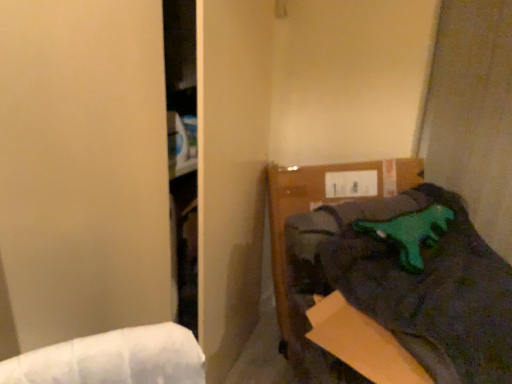
Where is `green rubber dinosaur at upper right`? The height and width of the screenshot is (384, 512). green rubber dinosaur at upper right is located at coordinates (410, 232).

The image size is (512, 384). What do you see at coordinates (410, 232) in the screenshot? I see `green rubber dinosaur at upper right` at bounding box center [410, 232].

The image size is (512, 384). In order to click on green plastic dinosaur at upper right in this screenshot , I will do tap(389, 277).

Describe the element at coordinates (389, 277) in the screenshot. I see `green plastic dinosaur at upper right` at that location.

This screenshot has width=512, height=384. I want to click on green rubber dinosaur at upper right, so click(410, 232).

Is green rubber dinosaur at upper right at the right side of green plastic dinosaur at upper right?

No.

Considering their positions, is green rubber dinosaur at upper right located in front of or behind green plastic dinosaur at upper right?

Visually, green rubber dinosaur at upper right is located behind green plastic dinosaur at upper right.

Which point is more distant from viewer, (419, 252) or (312, 191)?

The point (312, 191) is behind.

From the image's perspective, relative to green plastic dinosaur at upper right, is green rubber dinosaur at upper right above or below?

Based on their image positions, green rubber dinosaur at upper right is located above green plastic dinosaur at upper right.

From a real-world perspective, is green rubber dinosaur at upper right over green plastic dinosaur at upper right?

Yes.

Between green rubber dinosaur at upper right and green plastic dinosaur at upper right, which one has larger width?

Wider between the two is green plastic dinosaur at upper right.

Considering the sizes of objects green rubber dinosaur at upper right and green plastic dinosaur at upper right in the image provided, who is taller, green rubber dinosaur at upper right or green plastic dinosaur at upper right?

green plastic dinosaur at upper right is taller.

Who is smaller, green rubber dinosaur at upper right or green plastic dinosaur at upper right?

Answer: Smaller between the two is green rubber dinosaur at upper right.

Is green rubber dinosaur at upper right situated inside green plastic dinosaur at upper right or outside?

The correct answer is: inside.

Is green rubber dinosaur at upper right placed right next to green plastic dinosaur at upper right?

green rubber dinosaur at upper right and green plastic dinosaur at upper right are not in contact.

Is green rubber dinosaur at upper right aimed at green plastic dinosaur at upper right?

Yes.

How different are the orientations of green rubber dinosaur at upper right and green plastic dinosaur at upper right in degrees?

The angular difference between green rubber dinosaur at upper right and green plastic dinosaur at upper right is 3.64 degrees.

This screenshot has height=384, width=512. In order to click on animal above the green plastic dinosaur at upper right (from the image's perspective) in this screenshot , I will do `click(410, 232)`.

Which object is positioned more to the right, green plastic dinosaur at upper right or green rubber dinosaur at upper right?

Positioned to the right is green plastic dinosaur at upper right.

Is green plastic dinosaur at upper right in front of or behind green rubber dinosaur at upper right in the image?

In the image, green plastic dinosaur at upper right appears in front of green rubber dinosaur at upper right.

Considering the positions of point (451, 306) and point (398, 221), is point (451, 306) closer or farther from the camera than point (398, 221)?

Point (451, 306) appears to be closer to the viewer than point (398, 221).

From the image's perspective, is green plastic dinosaur at upper right located above or below green rubber dinosaur at upper right?

green plastic dinosaur at upper right is below green rubber dinosaur at upper right.

From a real-world perspective, between green plastic dinosaur at upper right and green rubber dinosaur at upper right, who is vertically higher?

green rubber dinosaur at upper right.

Is green plastic dinosaur at upper right thinner than green rubber dinosaur at upper right?

No.

Considering the relative sizes of green plastic dinosaur at upper right and green rubber dinosaur at upper right in the image provided, is green plastic dinosaur at upper right taller than green rubber dinosaur at upper right?

Yes, green plastic dinosaur at upper right is taller than green rubber dinosaur at upper right.

Considering the sizes of objects green plastic dinosaur at upper right and green rubber dinosaur at upper right in the image provided, who is smaller, green plastic dinosaur at upper right or green rubber dinosaur at upper right?

green rubber dinosaur at upper right is smaller.

Would you say green plastic dinosaur at upper right is outside green rubber dinosaur at upper right?

Yes, green plastic dinosaur at upper right is outside of green rubber dinosaur at upper right.

Would you say green plastic dinosaur at upper right is a long distance from green rubber dinosaur at upper right?

No, green plastic dinosaur at upper right is not far from green rubber dinosaur at upper right.

Consider the image. Could you tell me if green plastic dinosaur at upper right is turned towards green rubber dinosaur at upper right?

No, green plastic dinosaur at upper right is not turned towards green rubber dinosaur at upper right.

This screenshot has width=512, height=384. I want to click on furniture lying on the right of green rubber dinosaur at upper right, so click(x=389, y=277).

Where is `furniture in front of the green rubber dinosaur at upper right`? This screenshot has width=512, height=384. furniture in front of the green rubber dinosaur at upper right is located at coordinates (389, 277).

I want to click on furniture below the green rubber dinosaur at upper right (from the image's perspective), so click(389, 277).